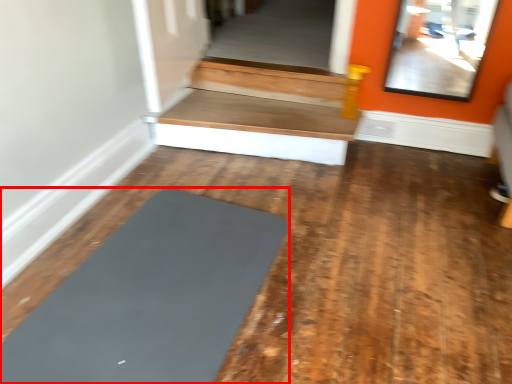
Question: Considering the relative positions of yoga (annotated by the red box) and stairwell in the image provided, where is yoga (annotated by the red box) located with respect to the staircase?

Choices:
 (A) left
 (B) right

Answer: (A)